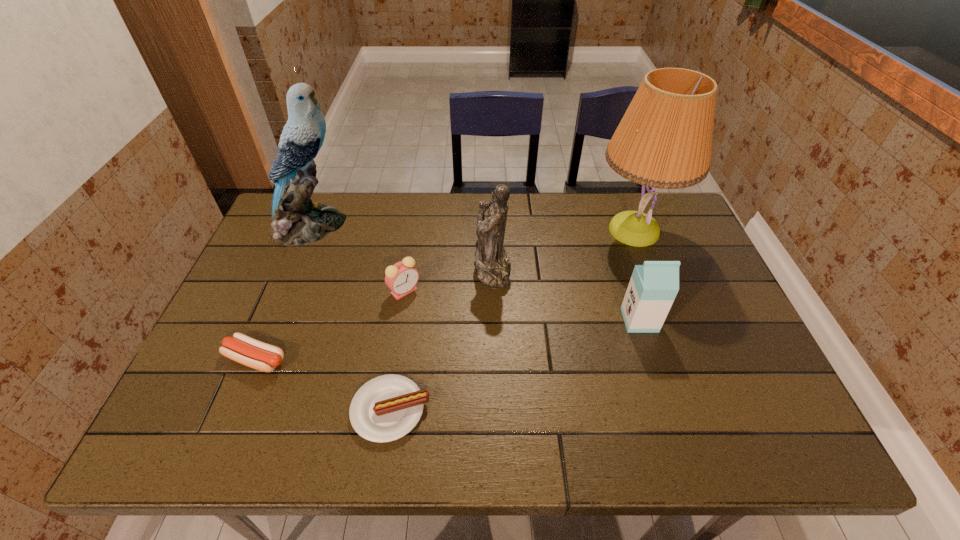
The width and height of the screenshot is (960, 540). What are the coordinates of `the shortest object` in the screenshot? It's located at (386, 408).

The width and height of the screenshot is (960, 540). I want to click on free space located on the side of the lamp near the pull switch, so click(483, 230).

Where is `vacant point located 0.270m on the side of the lamp near the pull switch`? vacant point located 0.270m on the side of the lamp near the pull switch is located at coordinates (505, 230).

The width and height of the screenshot is (960, 540). In order to click on free space located on the side of the lamp near the pull switch in this screenshot , I will do `click(556, 230)`.

This screenshot has width=960, height=540. Find the location of `vacant space located 0.220m on the face of the parakeet`. vacant space located 0.220m on the face of the parakeet is located at coordinates (417, 226).

Locate an element on the screen. free region located on the front-facing side of the third object from right to left is located at coordinates (337, 269).

Image resolution: width=960 pixels, height=540 pixels. Identify the location of free space located on the front-facing side of the third object from right to left. (450, 269).

Locate an element on the screen. This screenshot has width=960, height=540. free location located on the front-facing side of the third object from right to left is located at coordinates (458, 269).

Find the location of a particular element. free location located 0.190m on the right of the third nearest object is located at coordinates (728, 320).

Locate an element on the screen. vacant space located 0.090m on the face of the fifth tallest object is located at coordinates (398, 328).